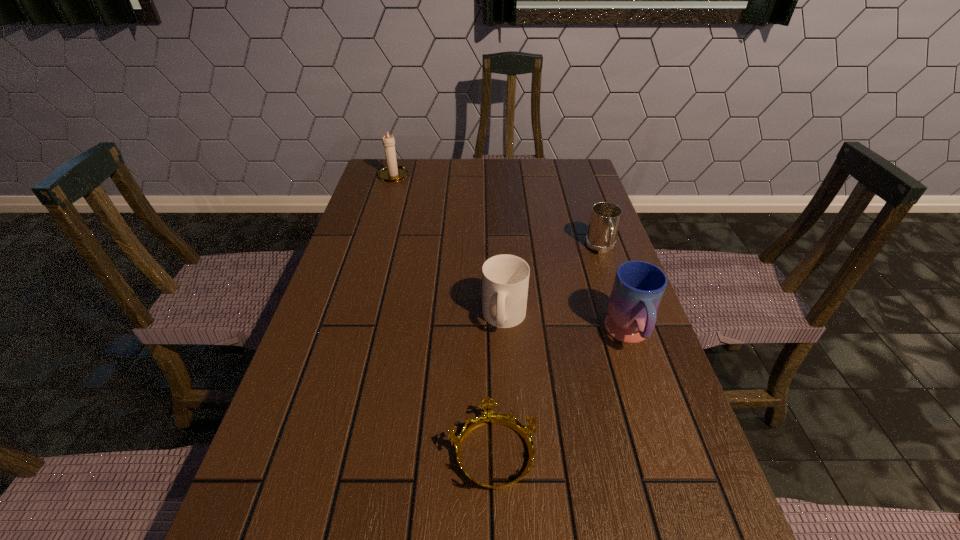
I want to click on object situated at the left edge, so click(392, 173).

You are a GUI agent. You are given a task and a screenshot of the screen. Output one action in this format:
    pyautogui.click(x=<x>, y=<y>)
    Task: Click on the object that is positioned at the far left corner
    This screenshot has width=960, height=540.
    Given the screenshot: What is the action you would take?
    pyautogui.click(x=392, y=173)

Find the location of a particular element. The image size is (960, 540). vacant space at the far edge is located at coordinates (x=435, y=183).

This screenshot has height=540, width=960. In the image, there is a desktop. Find the location of `vacant space at the left edge`. vacant space at the left edge is located at coordinates (287, 535).

Locate an element on the screen. The height and width of the screenshot is (540, 960). free space at the right edge of the desktop is located at coordinates (556, 221).

In the image, there is a desktop. At what (x,y) coordinates should I click in order to perform the action: click on free space at the far right corner. Please return your answer as a coordinate pair (x, y). The width and height of the screenshot is (960, 540). Looking at the image, I should click on (578, 184).

Identify the location of empty space between the farthest mug and the crown. The height and width of the screenshot is (540, 960). (547, 350).

I want to click on vacant area that lies between the farthest mug and the shortest object, so click(547, 350).

This screenshot has height=540, width=960. I want to click on free space that is in between the nearest object and the farthest object, so click(444, 314).

Find the location of `free spot between the farthest mug and the farthest object`. free spot between the farthest mug and the farthest object is located at coordinates (497, 212).